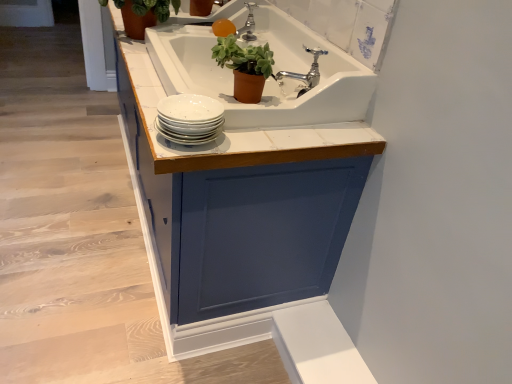
Identify the location of free point to the right of white glossy plates at center. This screenshot has height=384, width=512. (265, 137).